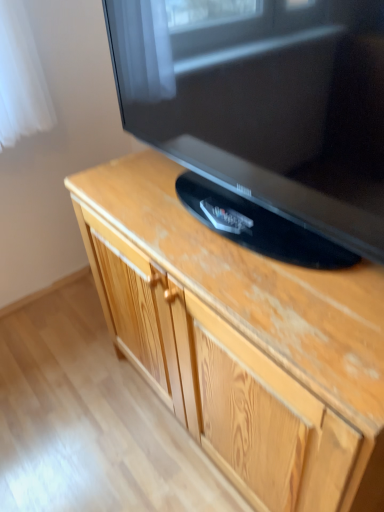
Question: Looking at the image, does wooden cabinet at center seem bigger or smaller compared to matte black television at upper center?

Choices:
 (A) small
 (B) big

Answer: (B)

Question: Considering their positions, is wooden cabinet at center located in front of or behind matte black television at upper center?

Choices:
 (A) front
 (B) behind

Answer: (B)

Question: Considering the positions of wooden cabinet at center and matte black television at upper center in the image, is wooden cabinet at center taller or shorter than matte black television at upper center?

Choices:
 (A) tall
 (B) short

Answer: (A)

Question: In the image, is matte black television at upper center positioned in front of or behind wooden cabinet at center?

Choices:
 (A) front
 (B) behind

Answer: (A)

Question: Looking at their shapes, would you say matte black television at upper center is wider or thinner than wooden cabinet at center?

Choices:
 (A) wide
 (B) thin

Answer: (B)

Question: From a real-world perspective, is matte black television at upper center physically located above or below wooden cabinet at center?

Choices:
 (A) below
 (B) above

Answer: (B)

Question: In terms of size, does matte black television at upper center appear bigger or smaller than wooden cabinet at center?

Choices:
 (A) big
 (B) small

Answer: (B)